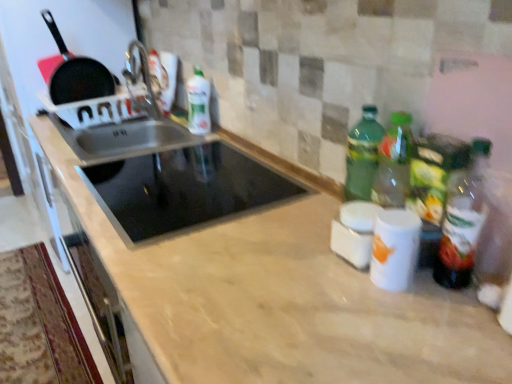
Question: Considering the relative sizes of black matte frying pan at upper left and green matte bottle at upper center, acting as the 2th bottle starting from the front, in the image provided, is black matte frying pan at upper left taller than green matte bottle at upper center, acting as the 2th bottle starting from the front,?

Choices:
 (A) yes
 (B) no

Answer: (A)

Question: Is black matte frying pan at upper left at the right side of green matte bottle at upper center, the first bottle viewed from the top?

Choices:
 (A) no
 (B) yes

Answer: (A)

Question: Does black matte frying pan at upper left have a lesser height compared to green matte bottle at upper center, the 1th bottle from the back?

Choices:
 (A) no
 (B) yes

Answer: (A)

Question: Does black matte frying pan at upper left have a smaller size compared to green matte bottle at upper center, the first bottle viewed from the top?

Choices:
 (A) yes
 (B) no

Answer: (B)

Question: Is black matte frying pan at upper left wider than green matte bottle at upper center, which is counted as the second bottle, starting from the right?

Choices:
 (A) yes
 (B) no

Answer: (B)

Question: From the image's perspective, is green matte bottle at upper center, which is the second bottle from bottom to top, above or below black glass cooktop at center?

Choices:
 (A) below
 (B) above

Answer: (B)

Question: Looking at the image, does green matte bottle at upper center, the first bottle viewed from the top, seem bigger or smaller compared to black glass cooktop at center?

Choices:
 (A) small
 (B) big

Answer: (A)

Question: Is green matte bottle at upper center, the 1th bottle from the back, to the left or to the right of black glass cooktop at center in the image?

Choices:
 (A) left
 (B) right

Answer: (A)

Question: Is green matte bottle at upper center, which is the second bottle from bottom to top, taller or shorter than black glass cooktop at center?

Choices:
 (A) short
 (B) tall

Answer: (B)

Question: Considering their positions, is black glass cooktop at center located in front of or behind green matte bottle at upper center, which is counted as the second bottle, starting from the right?

Choices:
 (A) front
 (B) behind

Answer: (A)

Question: Is black glass cooktop at center spatially inside green matte bottle at upper center, the 1th bottle from the back, or outside of it?

Choices:
 (A) outside
 (B) inside

Answer: (A)

Question: Is point (183, 150) closer or farther from the camera than point (206, 119)?

Choices:
 (A) farther
 (B) closer

Answer: (B)

Question: From the image's perspective, is black glass cooktop at center located above or below green matte bottle at upper center, which is the second bottle from bottom to top?

Choices:
 (A) below
 (B) above

Answer: (A)

Question: From the image's perspective, is green glass bottle at right, the second bottle in the top-to-bottom sequence, positioned above or below green matte bottle at upper center, acting as the 2th bottle starting from the front?

Choices:
 (A) below
 (B) above

Answer: (A)

Question: Considering the positions of green glass bottle at right, the second bottle when ordered from back to front, and green matte bottle at upper center, acting as the 2th bottle starting from the front, in the image, is green glass bottle at right, the second bottle when ordered from back to front, wider or thinner than green matte bottle at upper center, acting as the 2th bottle starting from the front,?

Choices:
 (A) wide
 (B) thin

Answer: (B)